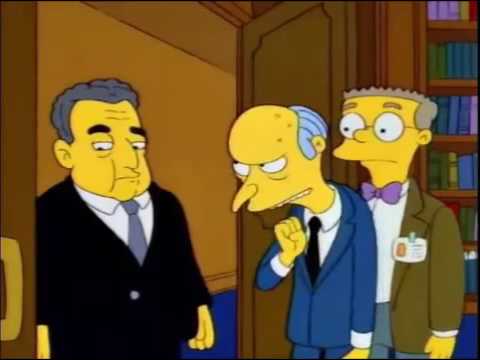
This screenshot has width=480, height=360. Identify the location of green books. point(438,63), point(436,169), point(469,226).